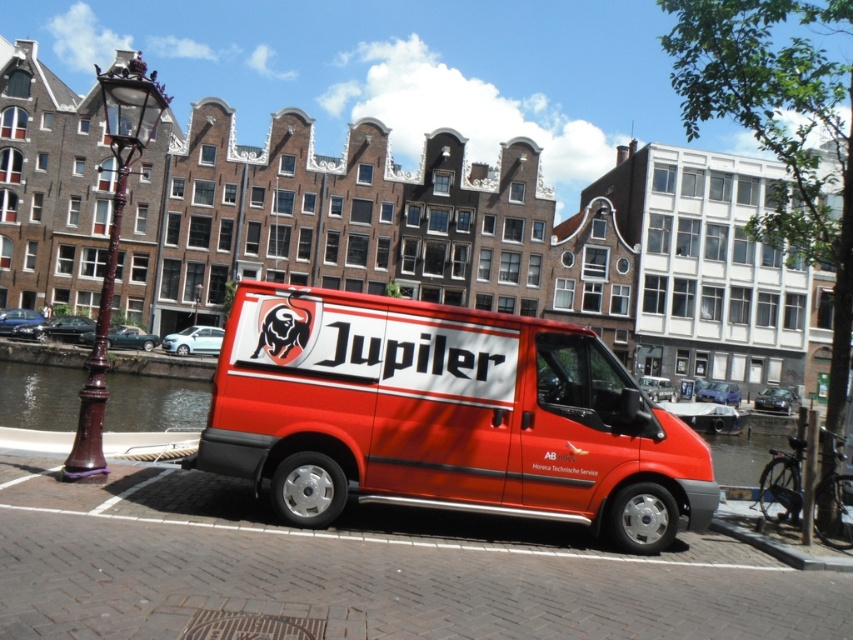
Consider the image. Can you confirm if shiny red van at center is shorter than transparent water at left?

No, shiny red van at center is not shorter than transparent water at left.

Does shiny red van at center appear under transparent water at left?

No, shiny red van at center is not below transparent water at left.

Is point (567, 342) less distant than point (48, 388)?

Yes, it is in front of point (48, 388).

This screenshot has height=640, width=853. Identify the location of shiny red van at center. 444,417.

Can you confirm if bronze lamppost at left is positioned above transparent water at left?

Indeed, bronze lamppost at left is positioned over transparent water at left.

Is bronze lamppost at left further to the viewer compared to transparent water at left?

No, bronze lamppost at left is in front of transparent water at left.

Find the location of a particular element. bronze lamppost at left is located at coordinates (112, 246).

Does shiny red van at center appear over bronze lamppost at left?

Incorrect, shiny red van at center is not positioned above bronze lamppost at left.

Who is more forward, (x=552, y=388) or (x=91, y=406)?

Point (x=552, y=388) is more forward.

Where is `shiny red van at center`? Image resolution: width=853 pixels, height=640 pixels. shiny red van at center is located at coordinates (444, 417).